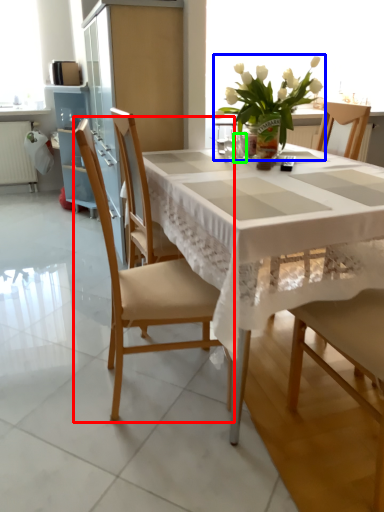
Question: Estimate the real-world distances between objects in this image. Which object is closer to chair (highlighted by a red box), houseplant (highlighted by a blue box) or tableware (highlighted by a green box)?

Choices:
 (A) houseplant
 (B) tableware

Answer: (B)